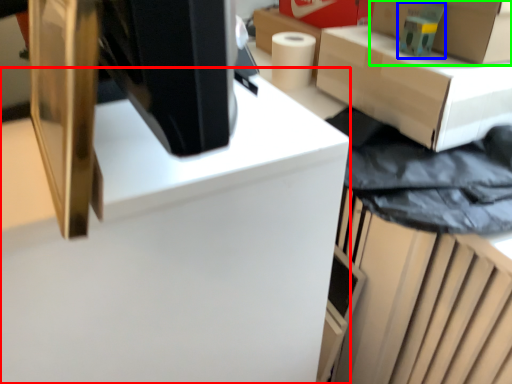
Question: Based on their relative distances, which object is farther from computer desk (highlighted by a red box)? Choose from toy (highlighted by a blue box) and box (highlighted by a green box).

Choices:
 (A) toy
 (B) box

Answer: (B)